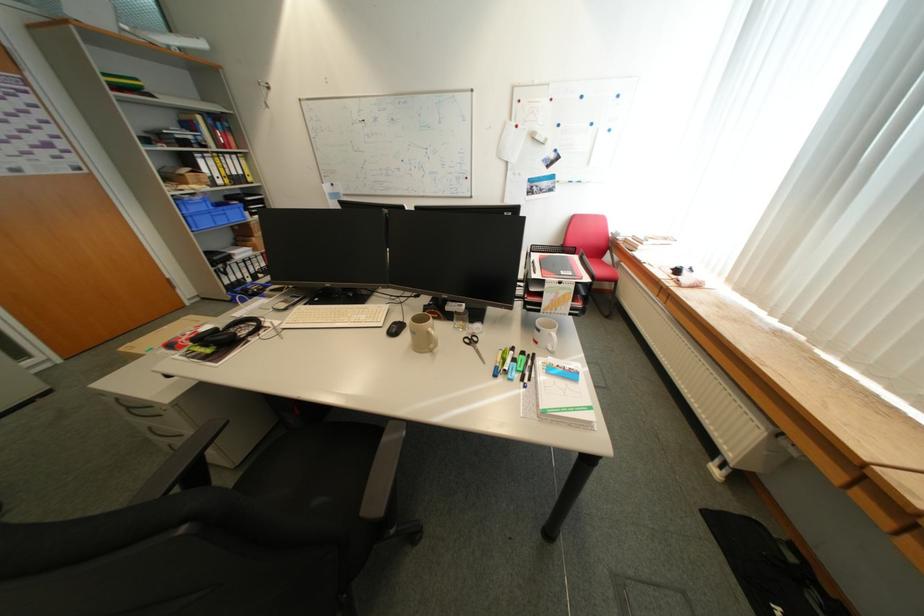
Where would you lift the green marker? Please return your answer as a coordinate pair (x, y).

(521, 361)